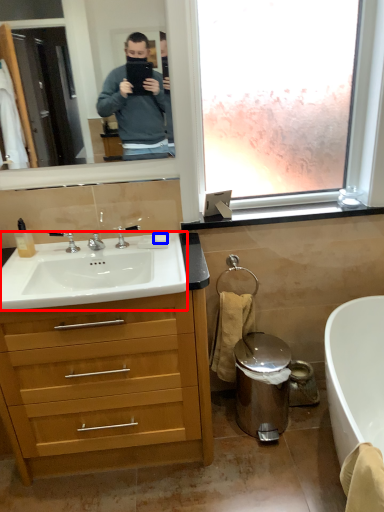
Question: Which of the following is the farthest to the observer, sink (highlighted by a red box) or soap (highlighted by a blue box)?

Choices:
 (A) sink
 (B) soap

Answer: (B)